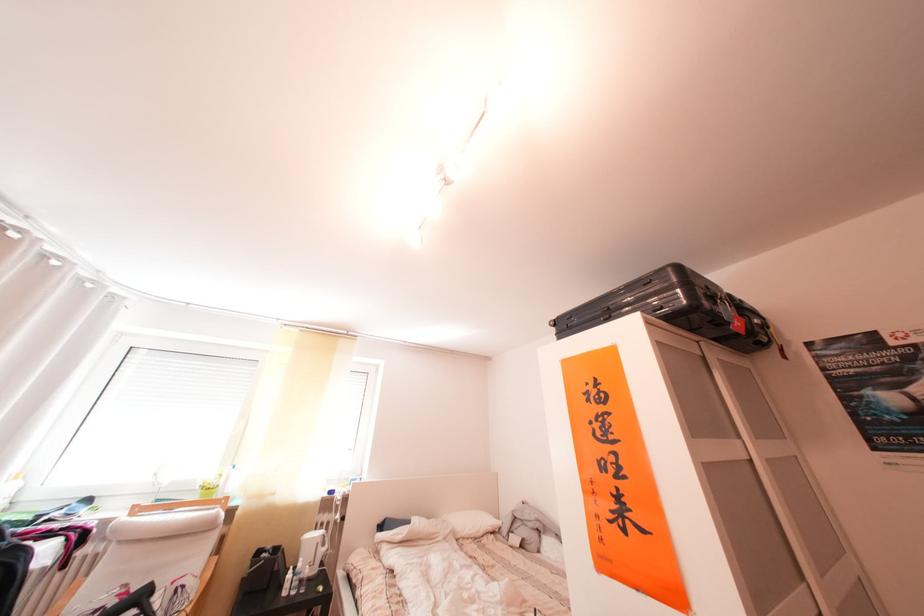
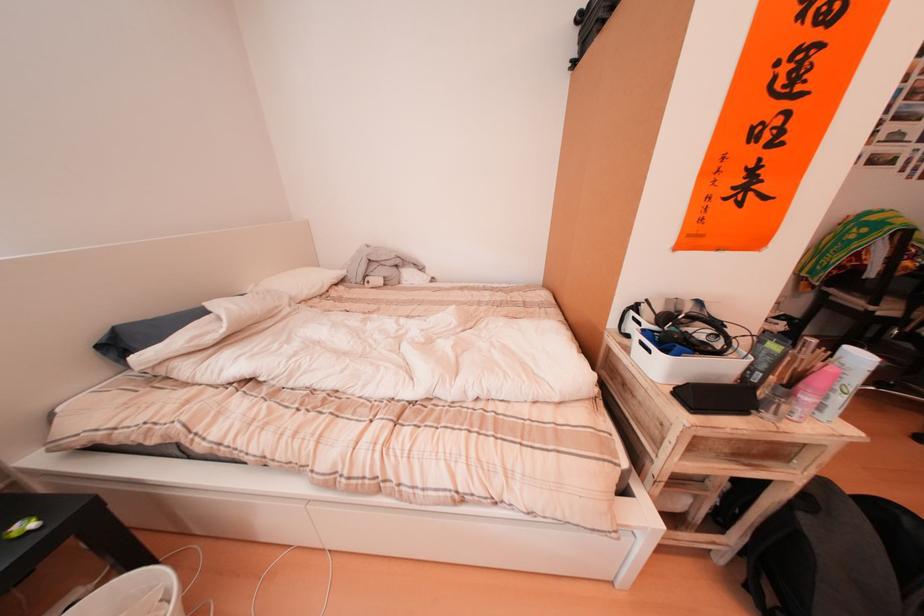
The point at (393, 525) is marked in the first image. Where is the corresponding point in the second image?

(105, 339)